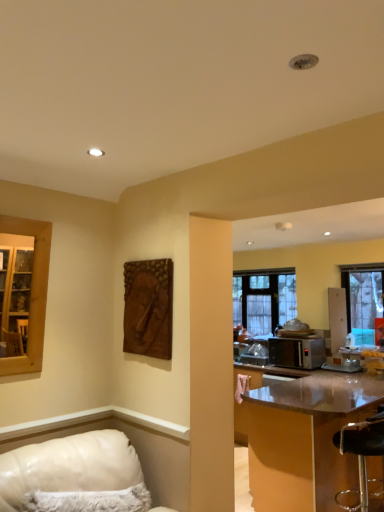
Question: Is shiny brown table at right aimed at brown textured wood at upper center?

Choices:
 (A) yes
 (B) no

Answer: (B)

Question: Is shiny brown table at right at the right side of brown textured wood at upper center?

Choices:
 (A) yes
 (B) no

Answer: (A)

Question: From the image's perspective, does shiny brown table at right appear higher than brown textured wood at upper center?

Choices:
 (A) no
 (B) yes

Answer: (A)

Question: Is shiny brown table at right outside of brown textured wood at upper center?

Choices:
 (A) no
 (B) yes

Answer: (B)

Question: Considering the relative sizes of shiny brown table at right and brown textured wood at upper center in the image provided, is shiny brown table at right wider than brown textured wood at upper center?

Choices:
 (A) no
 (B) yes

Answer: (B)

Question: From the image's perspective, is satin silver microwave at right located above or below white leather couch at lower left?

Choices:
 (A) below
 (B) above

Answer: (A)

Question: Relative to white leather couch at lower left, is satin silver microwave at right in front or behind?

Choices:
 (A) front
 (B) behind

Answer: (B)

Question: Is satin silver microwave at right bigger or smaller than white leather couch at lower left?

Choices:
 (A) small
 (B) big

Answer: (B)

Question: From a real-world perspective, is satin silver microwave at right above or below white leather couch at lower left?

Choices:
 (A) above
 (B) below

Answer: (A)

Question: Looking at the image, does clear glass window at center, positioned as the first window in back-to-front order, seem bigger or smaller compared to shiny brown table at right?

Choices:
 (A) big
 (B) small

Answer: (B)

Question: Is clear glass window at center, acting as the 1th window starting from the left, taller or shorter than shiny brown table at right?

Choices:
 (A) tall
 (B) short

Answer: (A)

Question: Is clear glass window at center, marked as the second window in a right-to-left arrangement, in front of or behind shiny brown table at right in the image?

Choices:
 (A) behind
 (B) front

Answer: (A)

Question: Does point (274, 314) appear closer or farther from the camera than point (249, 465)?

Choices:
 (A) closer
 (B) farther

Answer: (B)

Question: In terms of width, does brown textured wood at upper center look wider or thinner when compared to satin silver microwave at right?

Choices:
 (A) wide
 (B) thin

Answer: (B)

Question: Is brown textured wood at upper center in front of or behind satin silver microwave at right in the image?

Choices:
 (A) behind
 (B) front

Answer: (B)